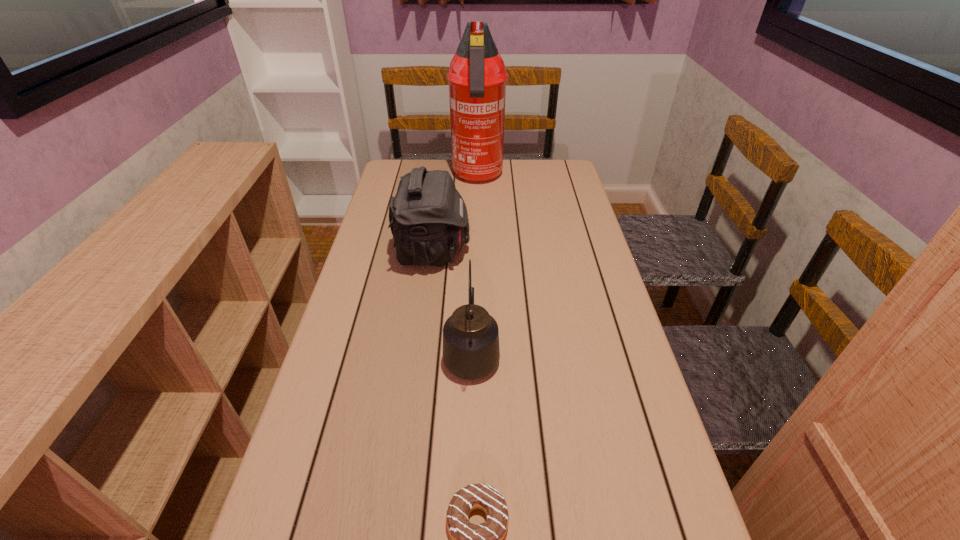
You are a GUI agent. You are given a task and a screenshot of the screen. Output one action in this format:
    pyautogui.click(x=<x>, y=<y>)
    Task: Click on the free space that satisfies the following two spatial constraints: 1. on the open flap of the shoulder bag; 2. spout on the kettle
    
    Given the screenshot: What is the action you would take?
    pyautogui.click(x=419, y=353)

The height and width of the screenshot is (540, 960). What are the coordinates of `free space that satisfies the following two spatial constraints: 1. on the open flap of the second farthest object; 2. spout on the second nearest object` in the screenshot? It's located at (419, 353).